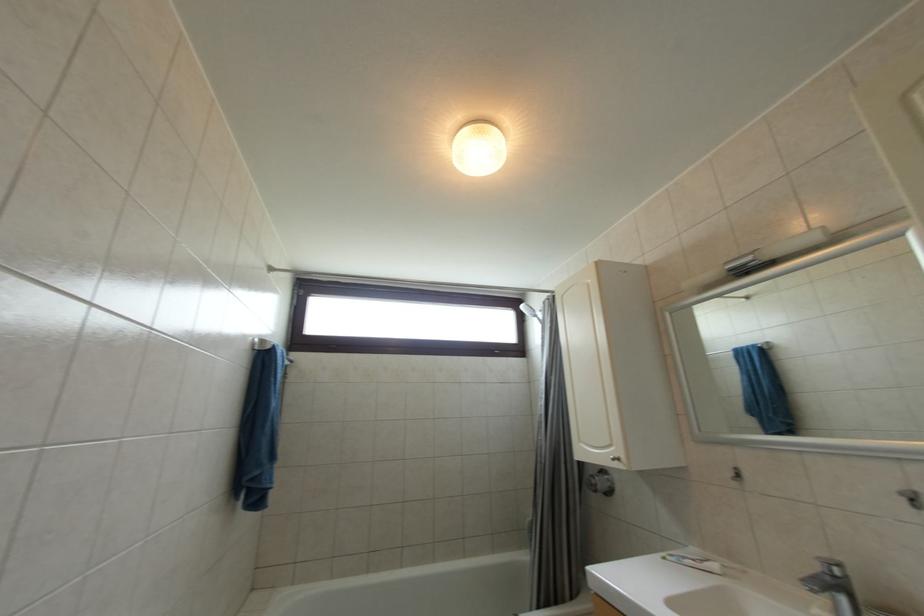
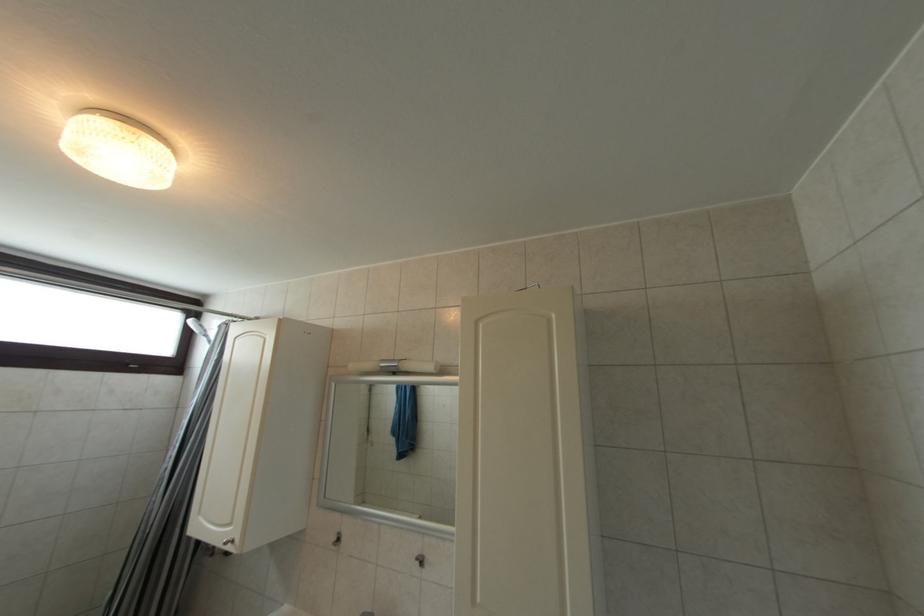
Question: The camera is either moving clockwise (left) or counter-clockwise (right) around the object. The first image is from the beginning of the video and the second image is from the end. Is the camera moving left or right when shooting the video?

Choices:
 (A) Left
 (B) Right

Answer: (A)